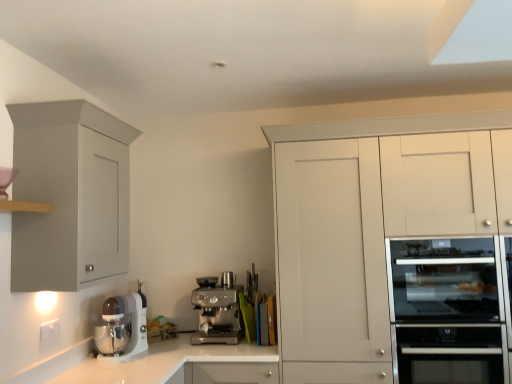
Question: Considering their positions, is white glossy countertop at center located in front of or behind satin silver oven at right?

Choices:
 (A) behind
 (B) front

Answer: (A)

Question: Is white glossy countertop at center inside the boundaries of satin silver oven at right, or outside?

Choices:
 (A) outside
 (B) inside

Answer: (A)

Question: Based on their relative distances, which object is nearer to the white glossy stand mixer at lower left, positioned as the 2th kitchen appliance in back-to-front order?

Choices:
 (A) stainless steel oven at right
 (B) matte gray cabinet at left, acting as the first cabinetry starting from the left
 (C) white glossy countertop at center
 (D) satin silver oven at right
 (E) satin silver metallic espresso machine at center, the first kitchen appliance in the back-to-front sequence

Answer: (C)

Question: Considering the real-world distances, which object is farthest from the stainless steel oven at right?

Choices:
 (A) white glossy countertop at center
 (B) white glossy stand mixer at lower left, positioned as the 2th kitchen appliance in back-to-front order
 (C) satin silver metallic espresso machine at center, which ranks as the first kitchen appliance in right-to-left order
 (D) white matte cabinet at right, the first cabinetry in the right-to-left sequence
 (E) satin silver oven at right

Answer: (B)